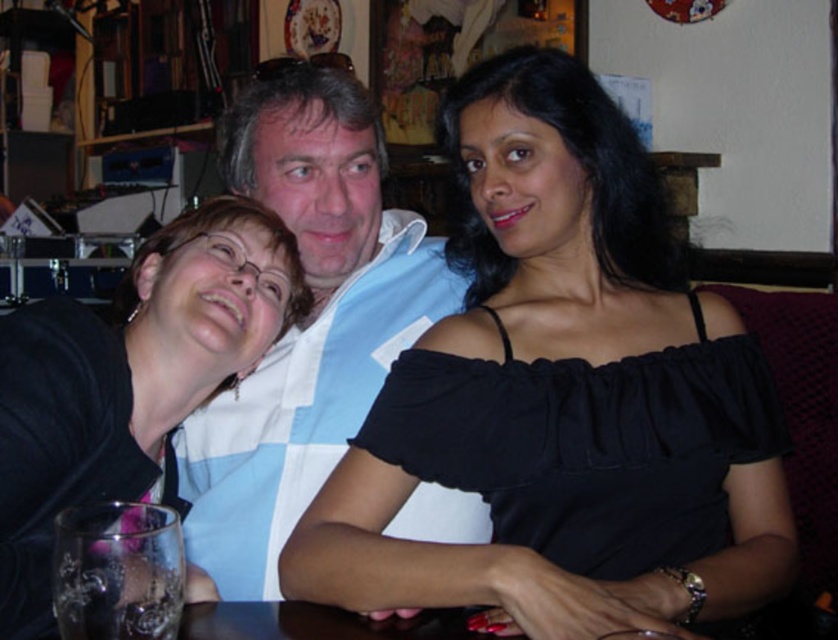
Question: Considering the real-world distances, which object is farthest from the black matte glass at left?

Choices:
 (A) black satin blouse at center
 (B) white cotton shirt at center

Answer: (A)

Question: Does black satin blouse at center have a larger size compared to black matte glass at left?

Choices:
 (A) no
 (B) yes

Answer: (B)

Question: Is black satin blouse at center positioned behind white cotton shirt at center?

Choices:
 (A) yes
 (B) no

Answer: (B)

Question: Does black satin blouse at center have a lesser width compared to white cotton shirt at center?

Choices:
 (A) yes
 (B) no

Answer: (B)

Question: Among these points, which one is farthest from the camera?

Choices:
 (A) (373, 596)
 (B) (47, 609)
 (C) (256, 492)

Answer: (C)

Question: Which point is farther to the camera?

Choices:
 (A) (436, 307)
 (B) (50, 396)
 (C) (722, 557)

Answer: (A)